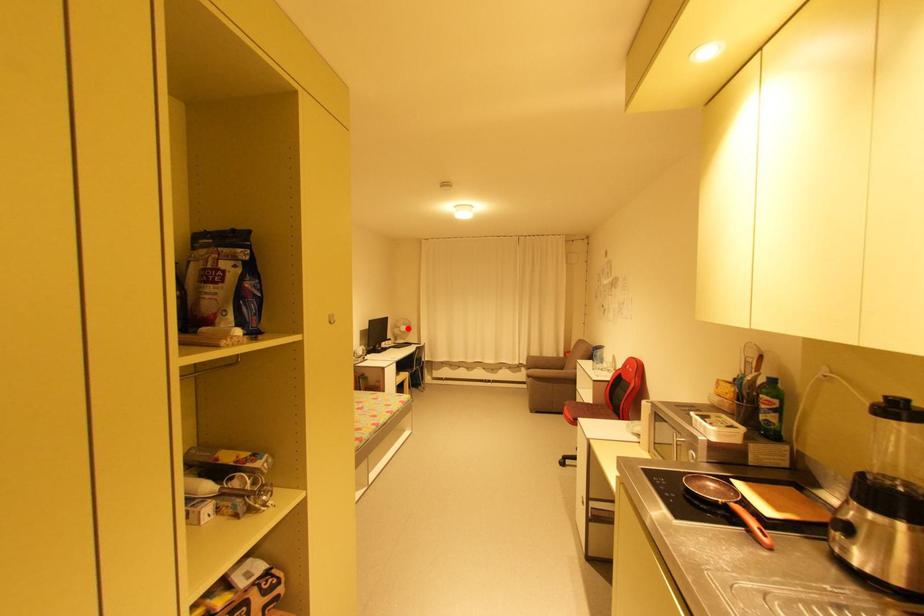
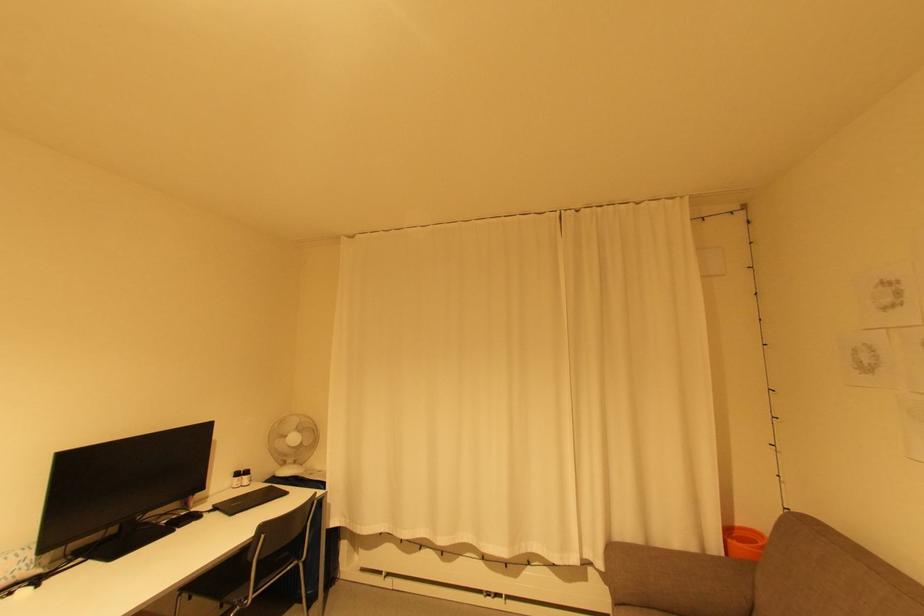
The point at the highlighted location is marked in the first image. Where is the corresponding point in the second image?

(298, 439)